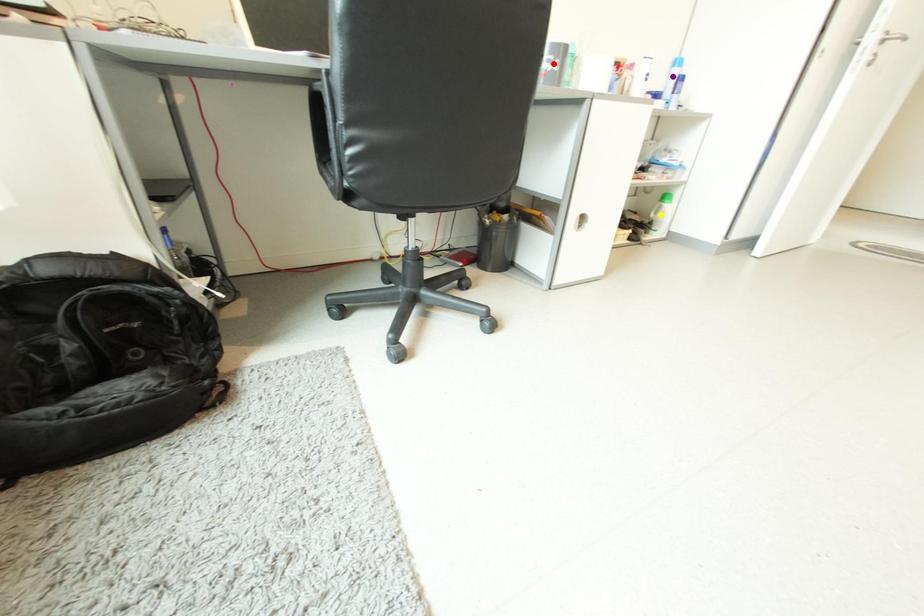
Looking at this image, order these from nearest to farthest:
A) yellow point
B) purple point
C) red point

red point → purple point → yellow point